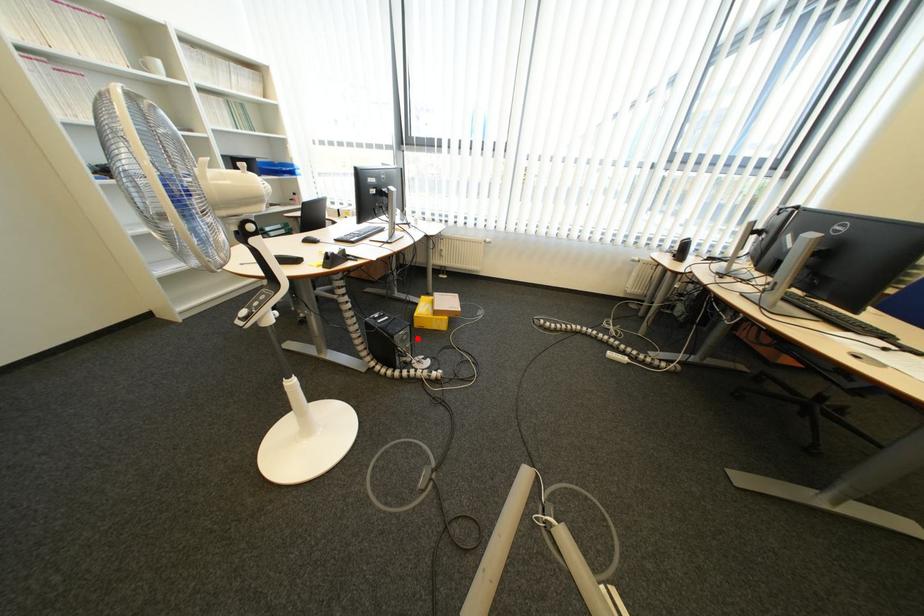
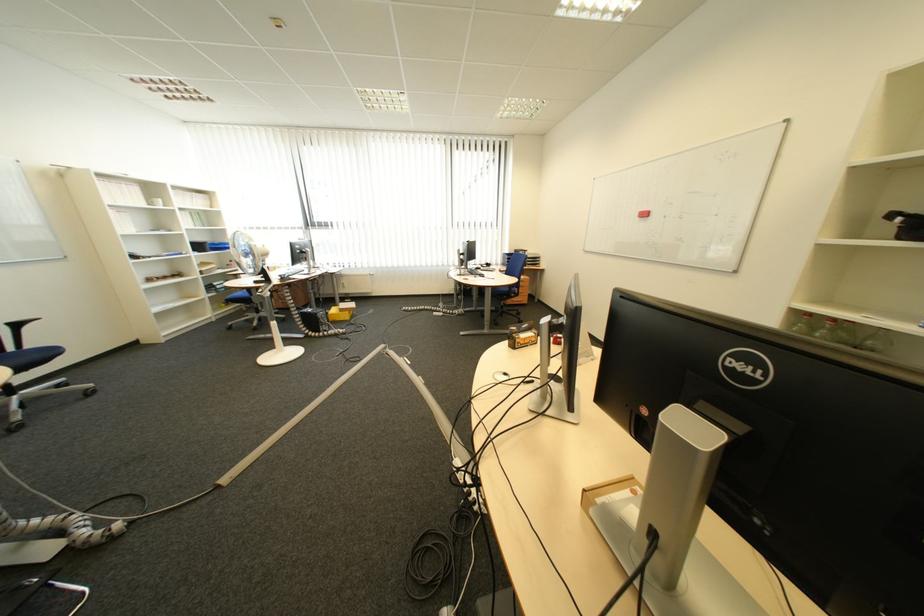
Locate, in the second image, the point that corresponds to the highlighted location in the first image.

(335, 317)